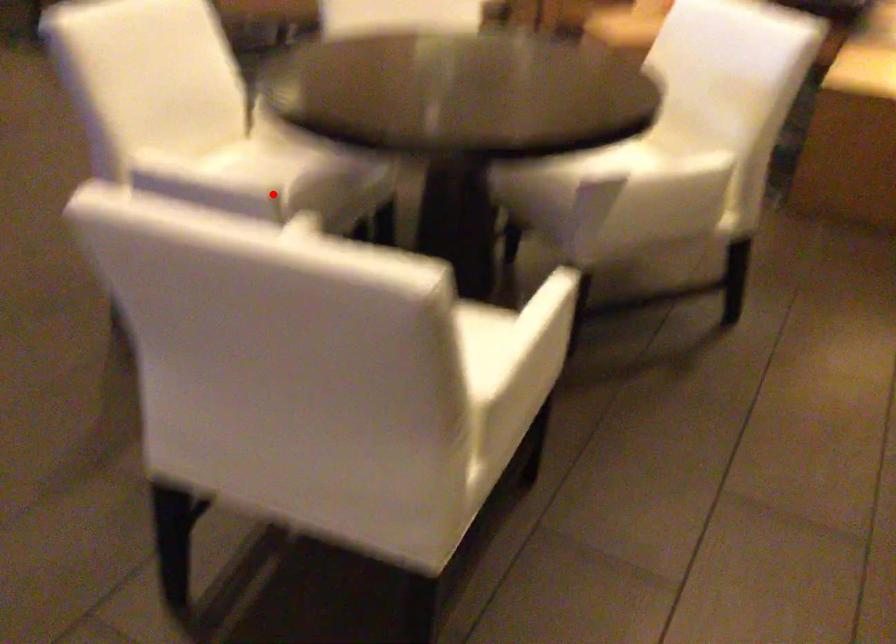
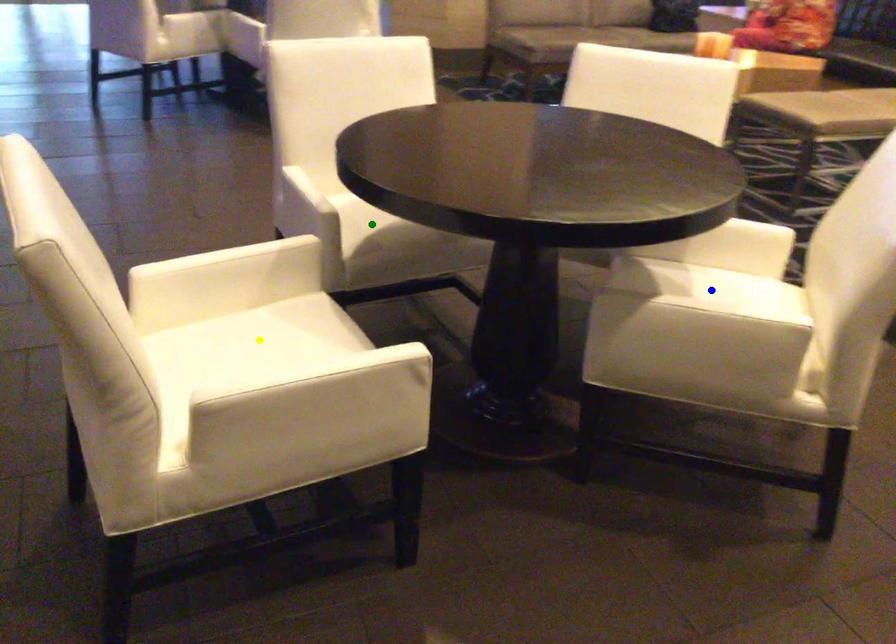
Question: I am providing you with two images of the same scene from different viewpoints. A red point is marked on the first image. You are given multiple points on the second image. Can you choose the point in image 2 that corresponds to the point in image 1?

Choices:
 (A) green point
 (B) yellow point
 (C) blue point

Answer: (A)